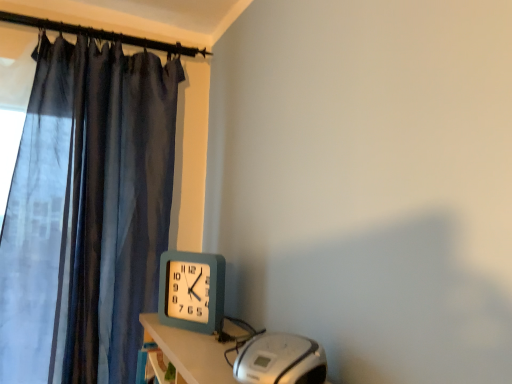
Question: Should I look upward or downward to see silver metallic cd player at lower right?

Choices:
 (A) up
 (B) down

Answer: (B)

Question: Considering the relative sizes of silver metallic cd player at lower right and teal plastic wall clock at upper center in the image provided, is silver metallic cd player at lower right thinner than teal plastic wall clock at upper center?

Choices:
 (A) no
 (B) yes

Answer: (A)

Question: Is silver metallic cd player at lower right further to camera compared to teal plastic wall clock at upper center?

Choices:
 (A) yes
 (B) no

Answer: (B)

Question: From a real-world perspective, is silver metallic cd player at lower right beneath teal plastic wall clock at upper center?

Choices:
 (A) no
 (B) yes

Answer: (B)

Question: From a real-world perspective, is silver metallic cd player at lower right over teal plastic wall clock at upper center?

Choices:
 (A) yes
 (B) no

Answer: (B)

Question: Is teal plastic wall clock at upper center a part of silver metallic cd player at lower right?

Choices:
 (A) no
 (B) yes

Answer: (A)

Question: Considering the relative sizes of silver metallic cd player at lower right and teal plastic wall clock at upper center in the image provided, is silver metallic cd player at lower right smaller than teal plastic wall clock at upper center?

Choices:
 (A) no
 (B) yes

Answer: (A)

Question: From the image's perspective, does teal plastic wall clock at upper center appear lower than silver metallic cd player at lower right?

Choices:
 (A) yes
 (B) no

Answer: (B)

Question: Is teal plastic wall clock at upper center not within silver metallic cd player at lower right?

Choices:
 (A) yes
 (B) no

Answer: (A)

Question: Considering the relative positions of teal plastic wall clock at upper center and silver metallic cd player at lower right in the image provided, is teal plastic wall clock at upper center in front of silver metallic cd player at lower right?

Choices:
 (A) yes
 (B) no

Answer: (B)

Question: Is teal plastic wall clock at upper center wider than silver metallic cd player at lower right?

Choices:
 (A) no
 (B) yes

Answer: (A)

Question: Can you confirm if teal plastic wall clock at upper center is taller than silver metallic cd player at lower right?

Choices:
 (A) yes
 (B) no

Answer: (A)

Question: Is teal plastic wall clock at upper center to the right of silver metallic cd player at lower right from the viewer's perspective?

Choices:
 (A) yes
 (B) no

Answer: (B)

Question: Is silver metallic cd player at lower right in front of or behind teal plastic wall clock at upper center in the image?

Choices:
 (A) front
 (B) behind

Answer: (A)